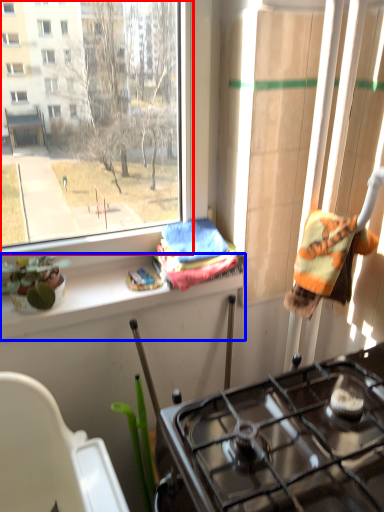
Question: Which of the following is the closest to the observer, window (highlighted by a red box) or ledge (highlighted by a blue box)?

Choices:
 (A) window
 (B) ledge

Answer: (A)